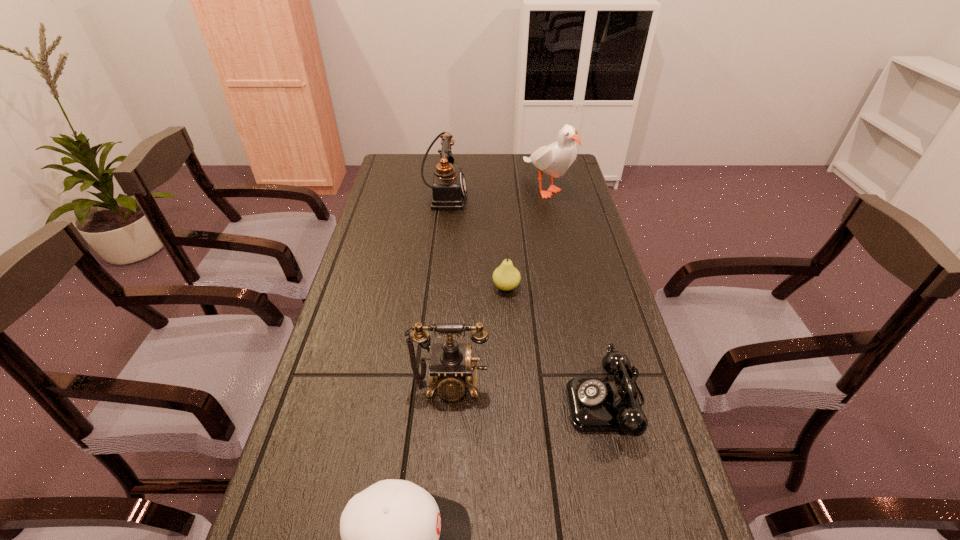
You are a GUI agent. You are given a task and a screenshot of the screen. Output one action in this format:
    pyautogui.click(x=<x>, y=<y>)
    Task: Click on the free location that satisfies the following two spatial constraints: 1. on the front of the third farthest object at the rotary dial; 2. on the left side of the farthest telephone
    
    Given the screenshot: What is the action you would take?
    pyautogui.click(x=434, y=287)

Where is `vacant space that satisfies the following two spatial constraints: 1. on the front of the fourth nearest object at the rotary dial; 2. on the right side of the farthest telephone`? This screenshot has height=540, width=960. vacant space that satisfies the following two spatial constraints: 1. on the front of the fourth nearest object at the rotary dial; 2. on the right side of the farthest telephone is located at coordinates (434, 287).

Identify the location of free space that satisfies the following two spatial constraints: 1. on the front of the farthest telephone at the rotary dial; 2. on the right side of the fourth nearest object. The height and width of the screenshot is (540, 960). (434, 287).